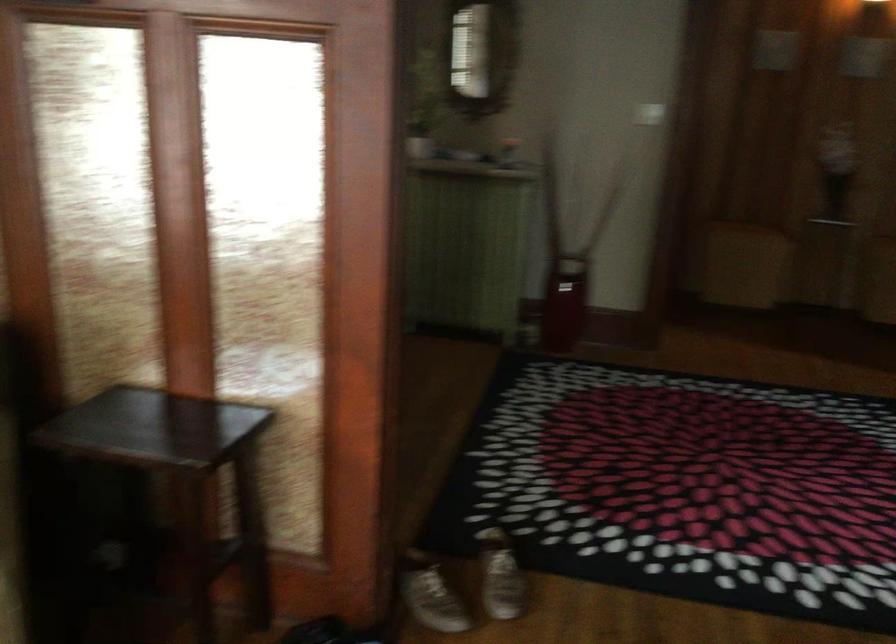
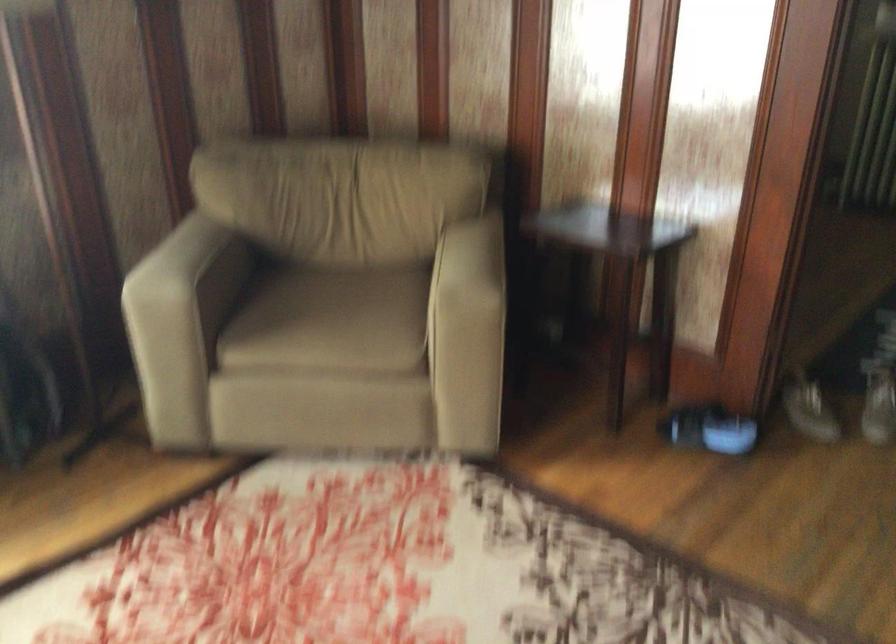
Question: The camera is either moving clockwise (left) or counter-clockwise (right) around the object. The first image is from the beginning of the video and the second image is from the end. Is the camera moving left or right when shooting the video?

Choices:
 (A) Left
 (B) Right

Answer: (B)